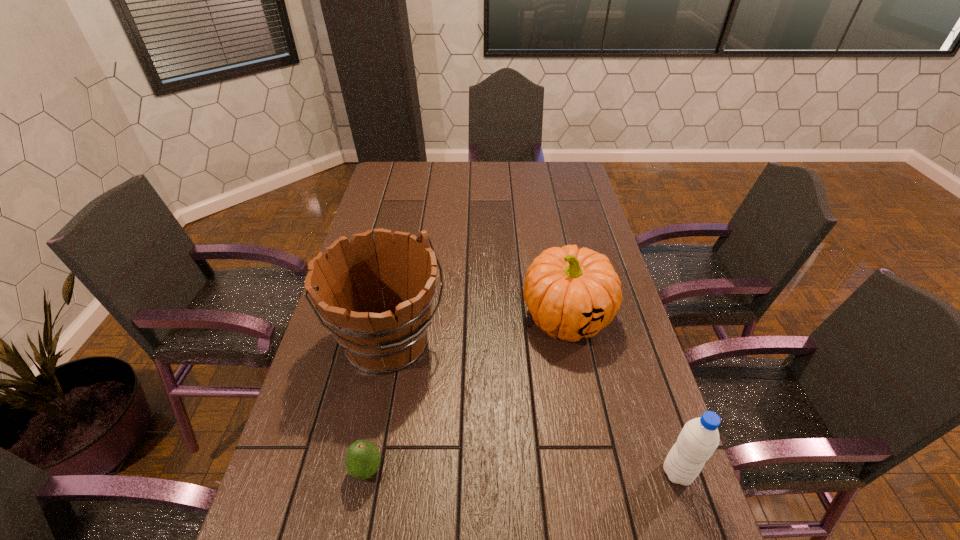
Point out which object is positioned as the third nearest to the wine bucket. Please provide its 2D coordinates. Your answer should be formatted as a tuple, i.e. [(x, y)], where the tuple contains the x and y coordinates of a point satisfying the conditions above.

[(699, 438)]

The width and height of the screenshot is (960, 540). Identify the location of object that can be found as the closest to the wine bucket. (362, 460).

This screenshot has height=540, width=960. I want to click on vacant region that satisfies the following two spatial constraints: 1. on the back side of the pumpkin; 2. on the right side of the shortest object, so click(396, 318).

Where is `vacant space that satisfies the following two spatial constraints: 1. on the back side of the second object from right to left; 2. on the right side of the avocado`? vacant space that satisfies the following two spatial constraints: 1. on the back side of the second object from right to left; 2. on the right side of the avocado is located at coordinates (396, 318).